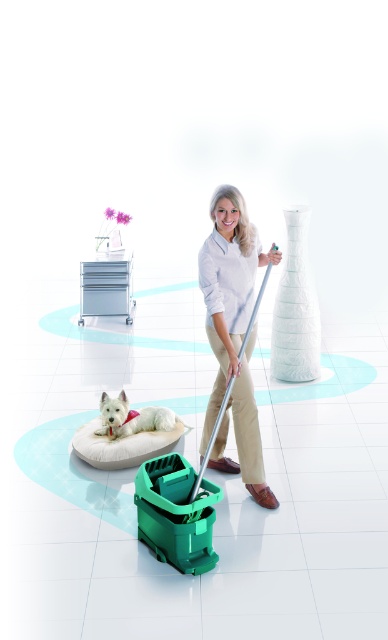
Where is `white matte shirt at center`? The width and height of the screenshot is (388, 640). white matte shirt at center is located at coordinates (233, 333).

The width and height of the screenshot is (388, 640). Describe the element at coordinates (233, 333) in the screenshot. I see `white matte shirt at center` at that location.

Which is in front, point (247, 406) or point (133, 449)?

Point (247, 406) is more forward.

Locate an element on the screen. Image resolution: width=388 pixels, height=640 pixels. white matte shirt at center is located at coordinates (233, 333).

Does white fabric dog bed at lower left have a lesser height compared to white soft dog at lower left?

Yes.

Is white fabric dog bed at lower left above white soft dog at lower left?

No.

Is point (112, 440) positioned in front of point (131, 410)?

Yes.

You are a GUI agent. You are given a task and a screenshot of the screen. Output one action in this format:
    pyautogui.click(x=<x>, y=<y>)
    Task: Click on the white fabric dog bed at lower left
    
    Given the screenshot: What is the action you would take?
    pyautogui.click(x=121, y=445)

Is white matte shirt at center taller than white soft dog at lower left?

Correct, white matte shirt at center is much taller as white soft dog at lower left.

Is white matte shirt at center further to the viewer compared to white soft dog at lower left?

No, it is not.

Where is `white matte shirt at center`? Image resolution: width=388 pixels, height=640 pixels. white matte shirt at center is located at coordinates (233, 333).